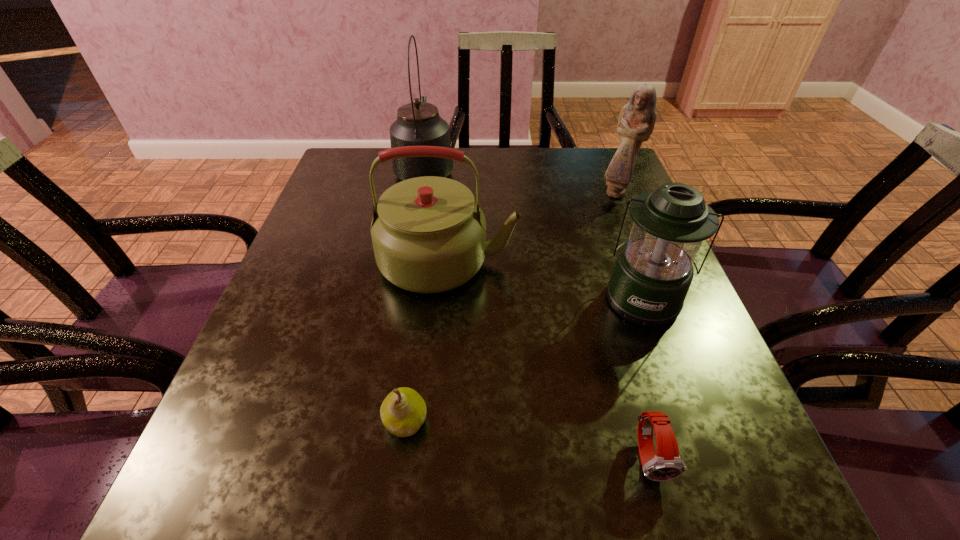
You are a GUI agent. You are given a task and a screenshot of the screen. Output one action in this format:
    pyautogui.click(x=<x>, y=<y>)
    Task: Click on the vacant space in between the shortest object and the lantern
    
    Given the screenshot: What is the action you would take?
    pyautogui.click(x=646, y=377)

This screenshot has width=960, height=540. What are the coordinates of `free area in between the taller kettle and the watch` in the screenshot? It's located at (538, 313).

This screenshot has width=960, height=540. What are the coordinates of `free point between the lantern and the taller kettle` in the screenshot? It's located at (534, 233).

Where is `free space between the tallest object and the lantern`? Image resolution: width=960 pixels, height=540 pixels. free space between the tallest object and the lantern is located at coordinates (534, 233).

At what (x,y) coordinates should I click in order to perform the action: click on object that is the closest to the nearer kettle. Please return your answer as a coordinate pair (x, y). Image resolution: width=960 pixels, height=540 pixels. Looking at the image, I should click on (418, 123).

Where is `object that is the second closest to the pear`? This screenshot has width=960, height=540. object that is the second closest to the pear is located at coordinates (667, 465).

Locate an element on the screen. This screenshot has height=540, width=960. free location that satisfies the following two spatial constraints: 1. on the front-facing side of the figurine; 2. at the spout of the nearer kettle is located at coordinates (644, 261).

The width and height of the screenshot is (960, 540). What are the coordinates of `vacant space that satisfies the following two spatial constraints: 1. at the spout of the shorter kettle; 2. on the left side of the lantern` in the screenshot? It's located at (445, 298).

Find the location of `blank area in the image that satisfies the following two spatial constraints: 1. on the back side of the fifth tallest object; 2. on the right side of the lantern`. blank area in the image that satisfies the following two spatial constraints: 1. on the back side of the fifth tallest object; 2. on the right side of the lantern is located at coordinates (421, 298).